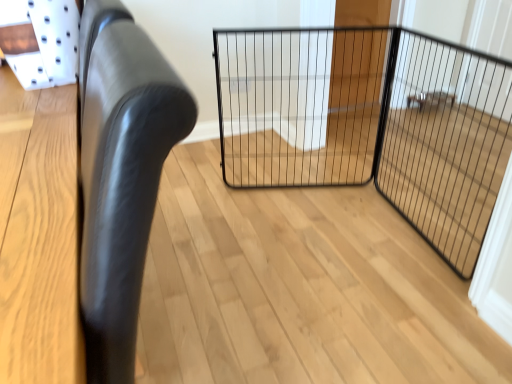
Where is `vacant space underneath black wire mesh gate at center (from a real-world perspective)`? This screenshot has height=384, width=512. vacant space underneath black wire mesh gate at center (from a real-world perspective) is located at coordinates (321, 190).